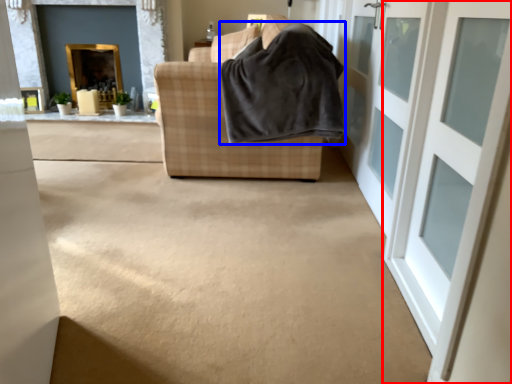
Question: Which object is further to the camera taking this photo, door (highlighted by a red box) or blanket (highlighted by a blue box)?

Choices:
 (A) door
 (B) blanket

Answer: (B)